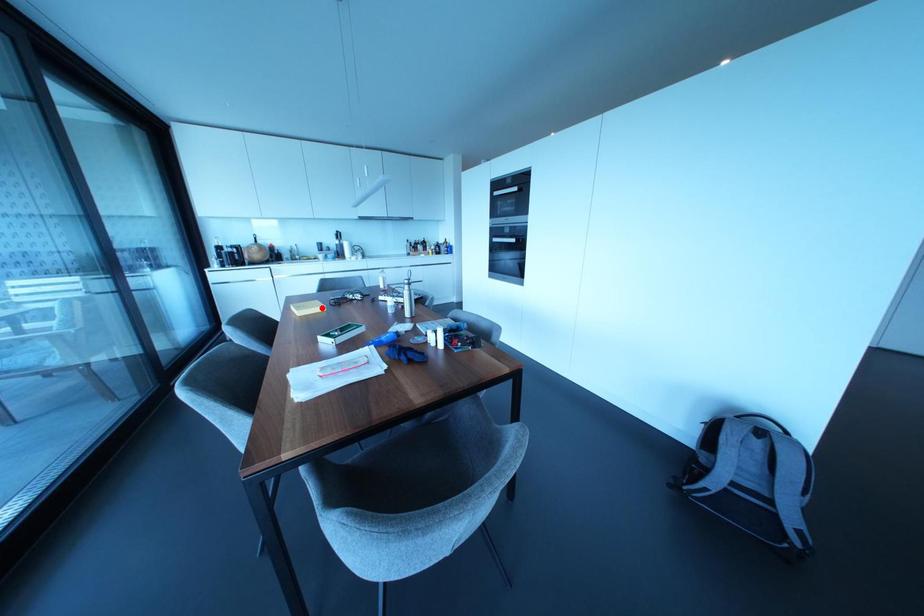
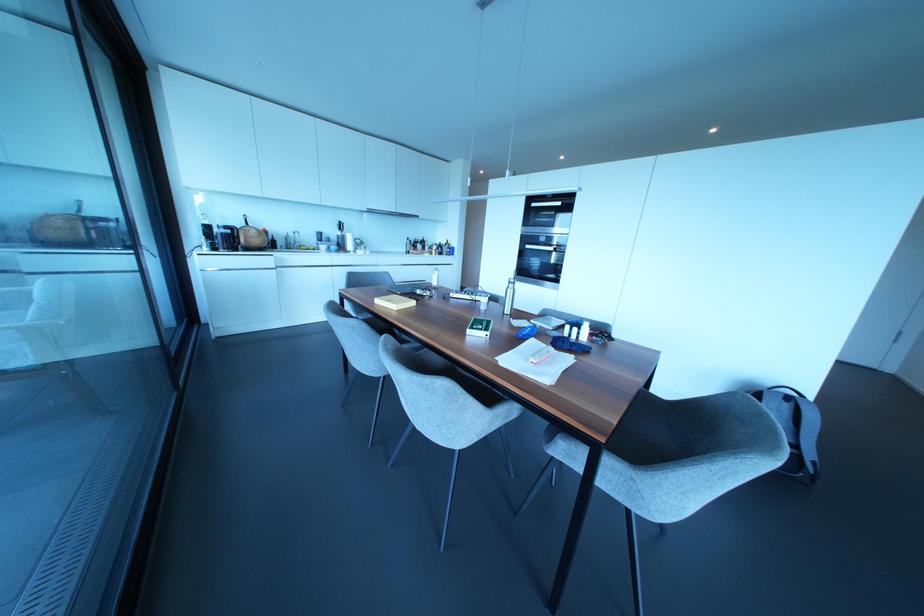
Locate, in the second image, the point that corresponds to the highlighted location in the first image.

(411, 302)